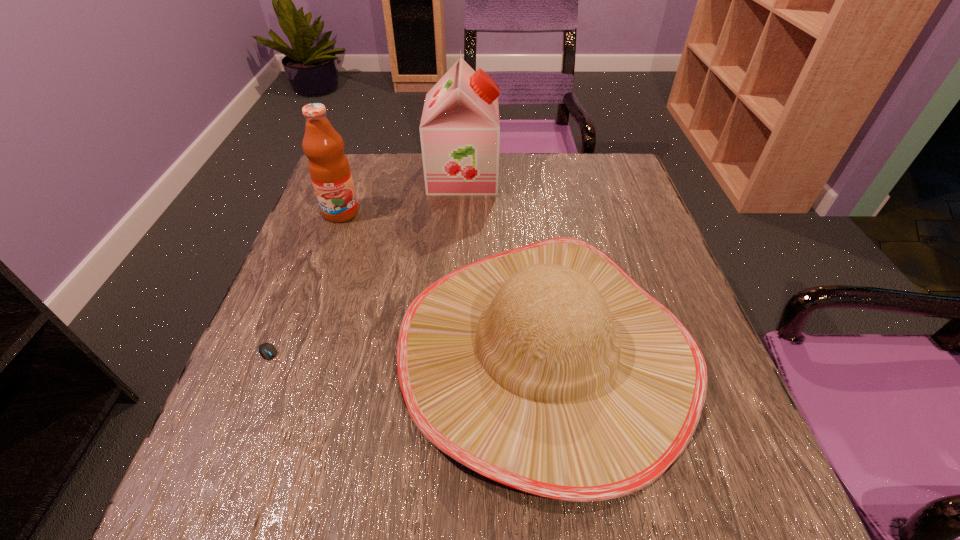
The width and height of the screenshot is (960, 540). Find the location of `object situated at the near edge`. object situated at the near edge is located at coordinates (547, 368).

At what (x,y) coordinates should I click in order to perform the action: click on fruit juice that is positioned at the left edge. Please return your answer as a coordinate pair (x, y). Looking at the image, I should click on (329, 169).

Find the location of a particular element. mouse located in the left edge section of the desktop is located at coordinates (266, 350).

Locate an element on the screen. The image size is (960, 540). object located at the right edge is located at coordinates (547, 368).

Where is `object situated at the far left corner`? This screenshot has width=960, height=540. object situated at the far left corner is located at coordinates (329, 169).

Identify the location of object that is positioned at the near right corner. The width and height of the screenshot is (960, 540). (547, 368).

What are the coordinates of `vacant area at the far edge of the desktop` in the screenshot? It's located at (535, 158).

This screenshot has width=960, height=540. In the image, there is a desktop. Find the location of `vacant space at the near edge`. vacant space at the near edge is located at coordinates (421, 468).

This screenshot has height=540, width=960. Identify the location of vacant point at the left edge. (320, 223).

Locate an element on the screen. The width and height of the screenshot is (960, 540). vacant space at the right edge of the desktop is located at coordinates (603, 221).